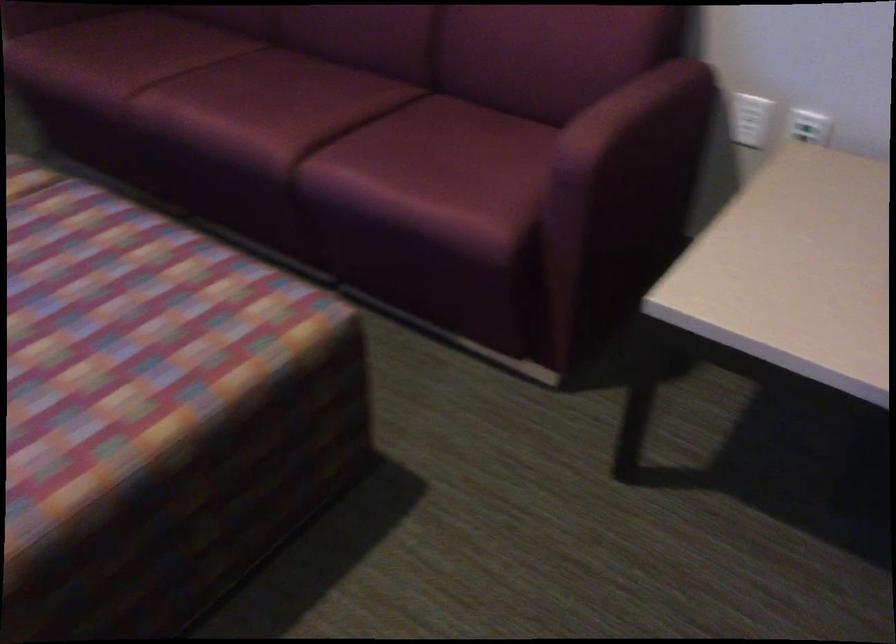
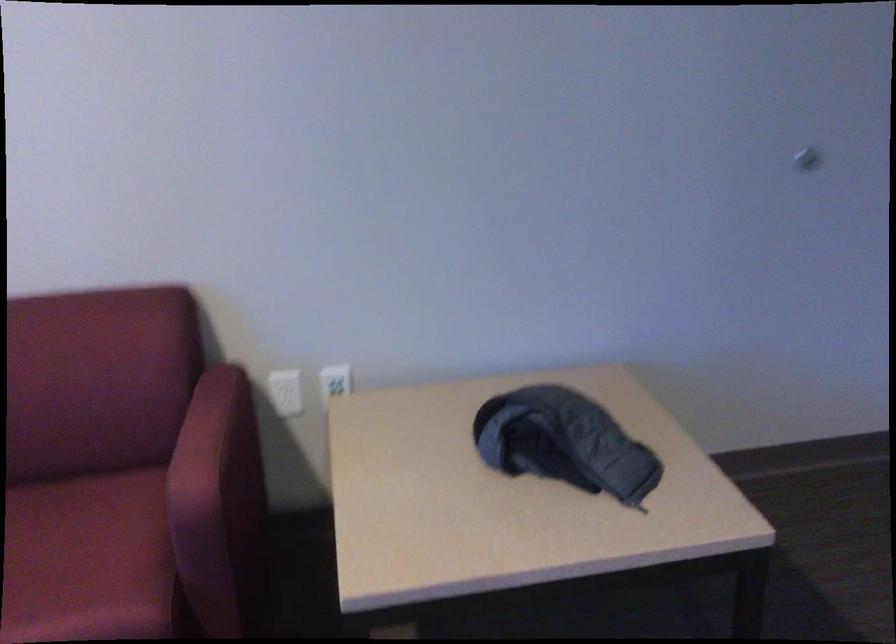
Question: The camera is either moving clockwise (left) or counter-clockwise (right) around the object. The first image is from the beginning of the video and the second image is from the end. Is the camera moving left or right when shooting the video?

Choices:
 (A) Left
 (B) Right

Answer: (A)